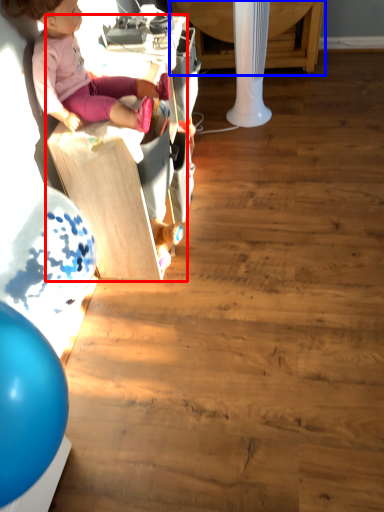
Question: Among these objects, which one is nearest to the camera, furniture (highlighted by a red box) or table (highlighted by a blue box)?

Choices:
 (A) furniture
 (B) table

Answer: (A)